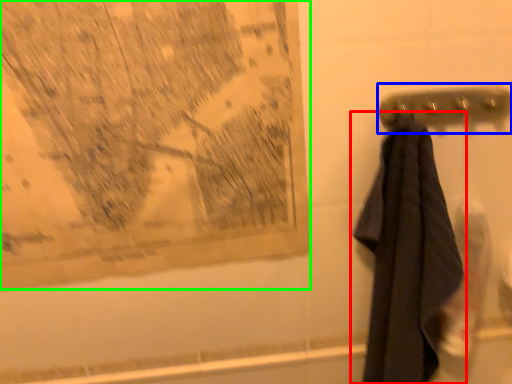
Question: Which is farther away from towel (highlighted by a red box)? towel bar (highlighted by a blue box) or map (highlighted by a green box)?

Choices:
 (A) towel bar
 (B) map

Answer: (B)